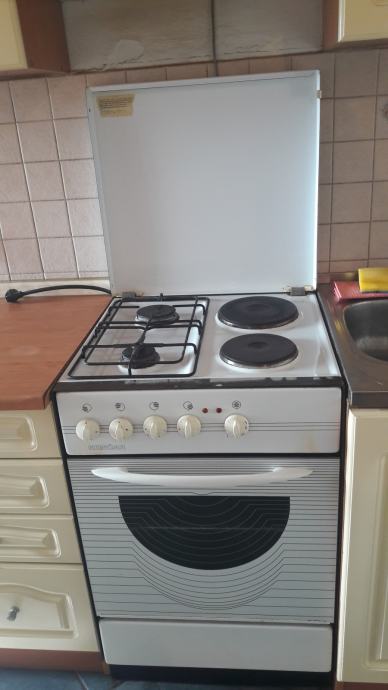
Locate an element on the screen. striped oven door is located at coordinates (319, 588).